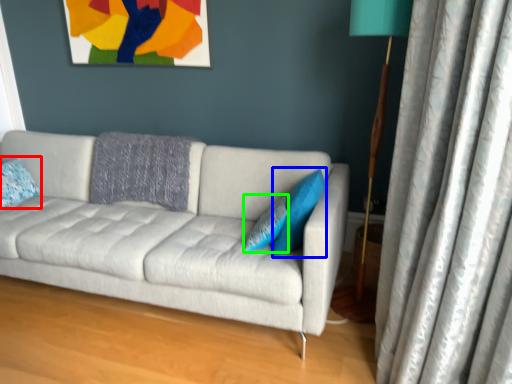
Question: Estimate the real-world distances between objects in this image. Which object is farther from pillow (highlighted by a red box), pillow (highlighted by a blue box) or pillow (highlighted by a green box)?

Choices:
 (A) pillow
 (B) pillow

Answer: (A)